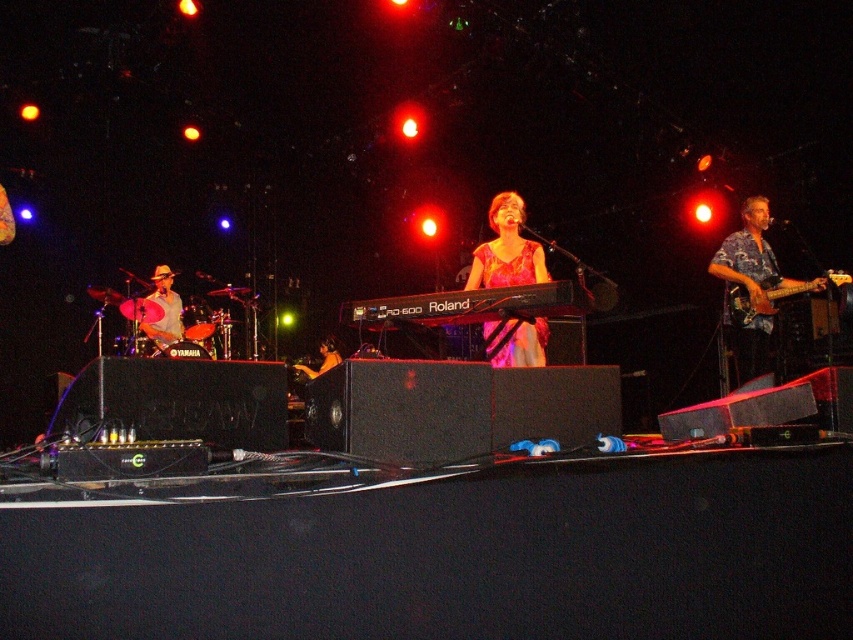
Which is more to the left, black matte keyboard at center or wooden electric guitar at right?

black matte keyboard at center is more to the left.

Who is shorter, black matte keyboard at center or wooden electric guitar at right?

Standing shorter between the two is black matte keyboard at center.

Describe the element at coordinates (469, 305) in the screenshot. Image resolution: width=853 pixels, height=640 pixels. I see `black matte keyboard at center` at that location.

Locate an element on the screen. black matte keyboard at center is located at coordinates (469, 305).

Between hawaiian print shirt at right and wooden electric guitar at right, which one is positioned higher?

hawaiian print shirt at right is higher up.

Based on the photo, can you confirm if hawaiian print shirt at right is bigger than wooden electric guitar at right?

Yes.

Identify the location of hawaiian print shirt at right. (752, 285).

Which of these two, wooden electric guitar at right or shiny black guitar at lower left, stands taller?

Standing taller between the two is shiny black guitar at lower left.

Is point (741, 305) farther from camera compared to point (320, 346)?

No.

Is point (746, 304) closer to camera compared to point (332, 356)?

Yes, point (746, 304) is closer to viewer.

The height and width of the screenshot is (640, 853). In order to click on wooden electric guitar at right in this screenshot , I will do `click(782, 296)`.